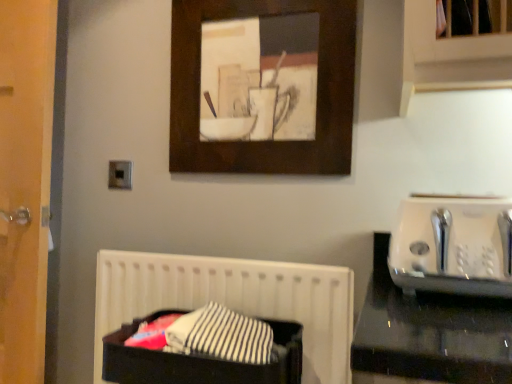
Question: Is wooden picture frame at upper center inside or outside of black fabric laundry basket at lower center?

Choices:
 (A) inside
 (B) outside

Answer: (B)

Question: Looking at their shapes, would you say wooden picture frame at upper center is wider or thinner than black fabric laundry basket at lower center?

Choices:
 (A) wide
 (B) thin

Answer: (B)

Question: Which object is the closest to the black fabric laundry basket at lower center?

Choices:
 (A) metallic silver outlet at upper left
 (B) black fabric at lower left
 (C) wooden picture frame at upper center
 (D) white plastic toaster at right

Answer: (B)

Question: Which object is the farthest from the black fabric at lower left?

Choices:
 (A) metallic silver outlet at upper left
 (B) white plastic toaster at right
 (C) wooden picture frame at upper center
 (D) black fabric laundry basket at lower center

Answer: (B)